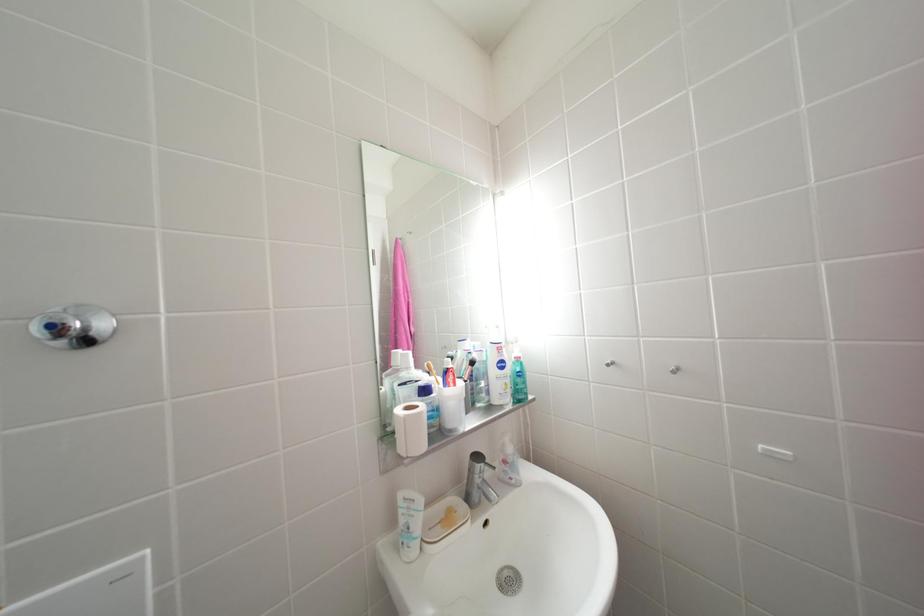
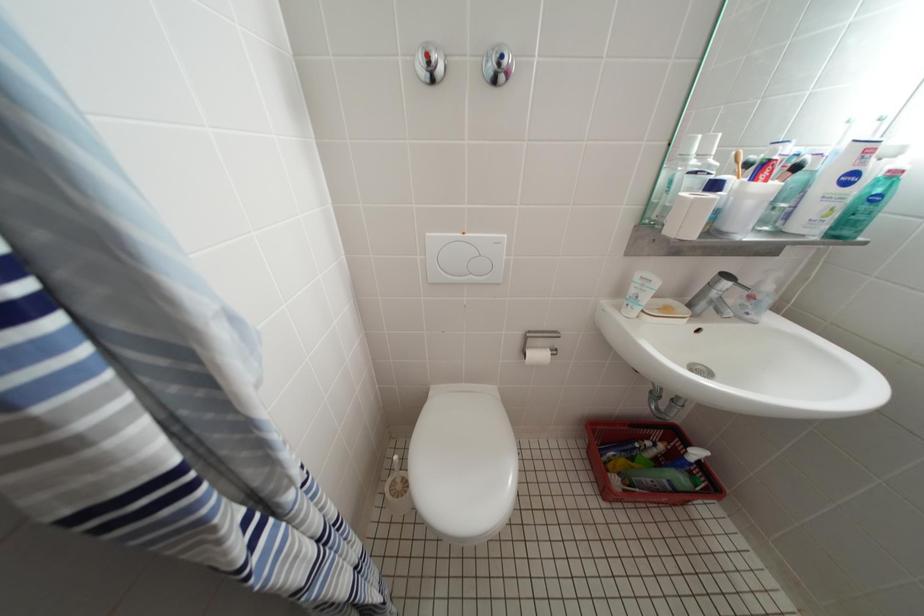
First-person continuous shooting, in which direction is the camera rotating?

The camera rotated toward left-down.